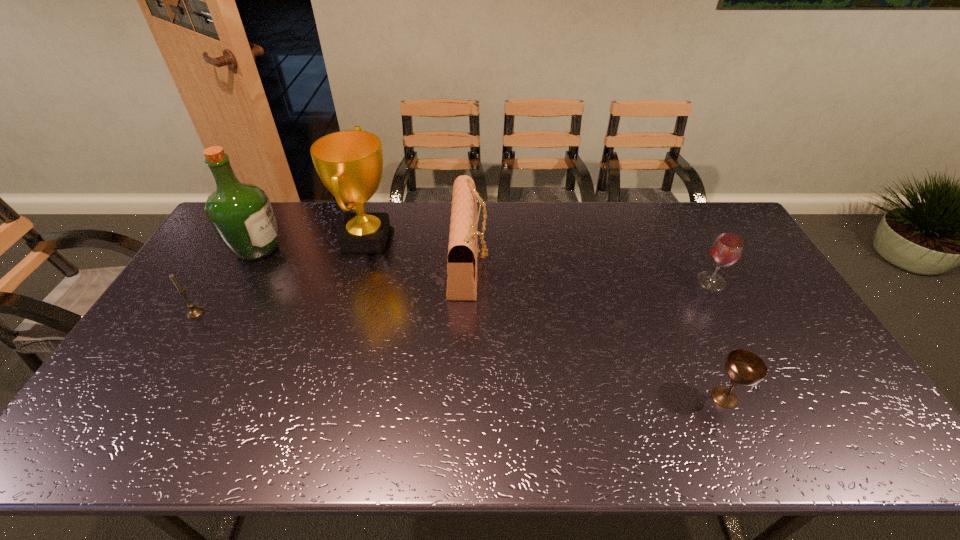
This screenshot has width=960, height=540. Find the location of `liquor`. liquor is located at coordinates (241, 214).

The height and width of the screenshot is (540, 960). Find the location of `the fourth object from right to left`. the fourth object from right to left is located at coordinates (350, 163).

Identify the location of the fourth shortest object. (462, 249).

Where is `handbag`? handbag is located at coordinates (462, 249).

Locate an element on the screen. wineglass is located at coordinates (726, 250).

Find the location of a particular element. the second nearest object is located at coordinates (194, 312).

The image size is (960, 540). In order to click on the nearest object in this screenshot , I will do `click(743, 367)`.

At what (x,y) coordinates should I click in order to perform the action: click on the second object from right to left. Please return your answer as a coordinate pair (x, y). The height and width of the screenshot is (540, 960). Looking at the image, I should click on (743, 367).

Where is `vacant space situated 0.220m on the front-facing side of the liquor`? vacant space situated 0.220m on the front-facing side of the liquor is located at coordinates (348, 249).

Locate an element on the screen. The image size is (960, 540). free region located on the front-facing side of the award is located at coordinates (414, 243).